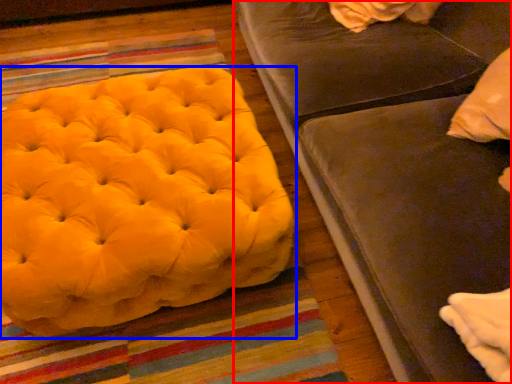
Question: Which object is closer to the camera taking this photo, studio couch (highlighted by a red box) or furniture (highlighted by a blue box)?

Choices:
 (A) studio couch
 (B) furniture

Answer: (A)